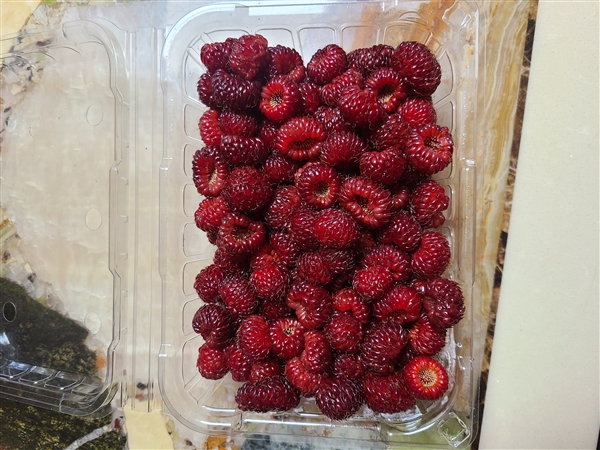
Identify the location of plain white surface. The height and width of the screenshot is (450, 600). (532, 410).